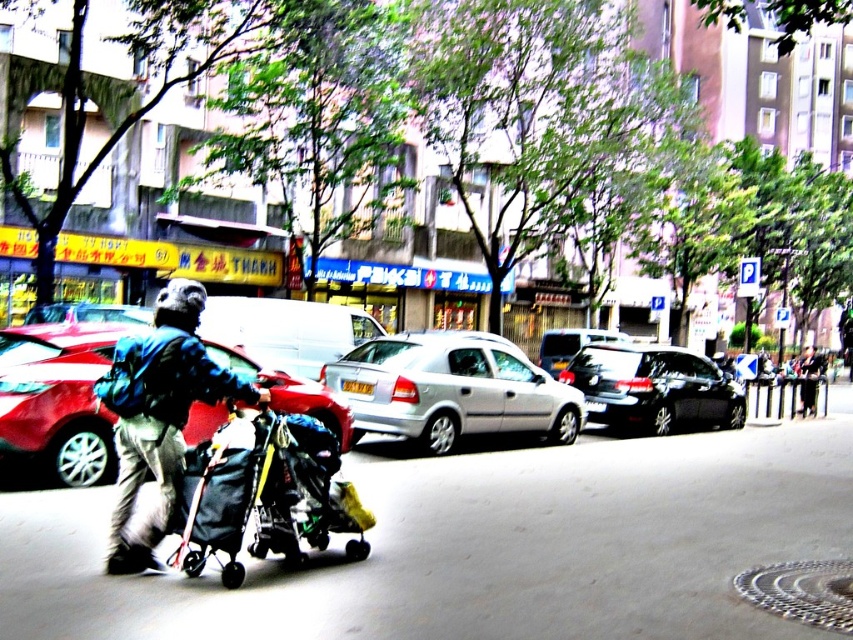
You are a delivery driver who needs to park your vehicle in the urban street scene shown. The parking spot for your delivery is directly behind the silver metallic hatchback at center. Based on the scene description, can you estimate the 2D coordinates where you should position your vehicle to park correctly?

The silver metallic hatchback at center is located at point (451, 388). Therefore, to park directly behind it, you should position your vehicle at coordinates slightly higher than 0.609 on the x and y axes, ensuring you are aligned with the hatchback while maintaining a safe distance.

You are a delivery person trying to navigate through the street. You see the metallic silver car at center and the dark blue backpack at left. Which object is wider?

The metallic silver car at center is wider than the dark blue backpack at left according to the description.